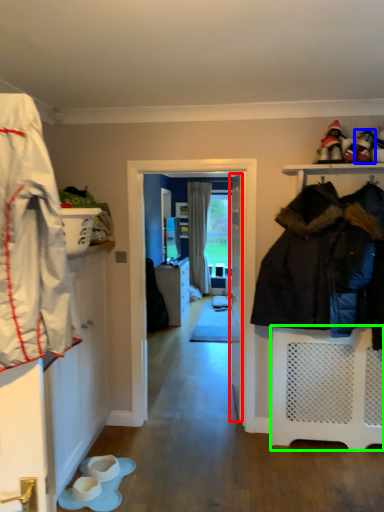
Question: Which is nearer to the door (highlighted by a red box)? footwear (highlighted by a blue box) or shelf (highlighted by a green box).

Choices:
 (A) footwear
 (B) shelf

Answer: (B)